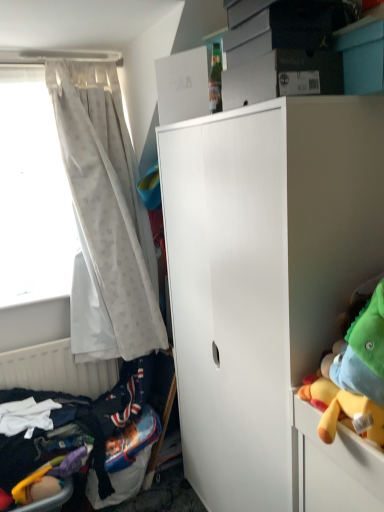
Question: Does white matte radiator at lower left lie in front of dark blue fabric bed at lower left?

Choices:
 (A) yes
 (B) no

Answer: (B)

Question: Is white matte radiator at lower left directly adjacent to dark blue fabric bed at lower left?

Choices:
 (A) no
 (B) yes

Answer: (A)

Question: Can you confirm if white matte radiator at lower left is smaller than dark blue fabric bed at lower left?

Choices:
 (A) yes
 (B) no

Answer: (A)

Question: Considering the relative sizes of white matte radiator at lower left and dark blue fabric bed at lower left in the image provided, is white matte radiator at lower left wider than dark blue fabric bed at lower left?

Choices:
 (A) no
 (B) yes

Answer: (A)

Question: Is white matte radiator at lower left at the left side of dark blue fabric bed at lower left?

Choices:
 (A) no
 (B) yes

Answer: (B)

Question: Considering the positions of point (1, 232) and point (236, 329), is point (1, 232) closer or farther from the camera than point (236, 329)?

Choices:
 (A) farther
 (B) closer

Answer: (A)

Question: Considering the positions of white sheer curtain at left and white matte cabinet at center in the image, is white sheer curtain at left wider or thinner than white matte cabinet at center?

Choices:
 (A) thin
 (B) wide

Answer: (A)

Question: Is white sheer curtain at left bigger or smaller than white matte cabinet at center?

Choices:
 (A) small
 (B) big

Answer: (A)

Question: From their relative heights in the image, would you say white sheer curtain at left is taller or shorter than white matte cabinet at center?

Choices:
 (A) tall
 (B) short

Answer: (B)

Question: Considering the positions of point (132, 297) and point (233, 376), is point (132, 297) closer or farther from the camera than point (233, 376)?

Choices:
 (A) closer
 (B) farther

Answer: (B)

Question: Considering the positions of white sheer curtain at left and white matte cabinet at center in the image, is white sheer curtain at left bigger or smaller than white matte cabinet at center?

Choices:
 (A) big
 (B) small

Answer: (B)

Question: Is white sheer curtain at left inside the boundaries of white matte cabinet at center, or outside?

Choices:
 (A) inside
 (B) outside

Answer: (B)

Question: From the image's perspective, is white sheer curtain at left above or below white matte cabinet at center?

Choices:
 (A) below
 (B) above

Answer: (B)

Question: In terms of size, does white matte radiator at lower left appear bigger or smaller than white matte cabinet at center?

Choices:
 (A) big
 (B) small

Answer: (B)

Question: Considering the positions of point (23, 367) and point (294, 369), is point (23, 367) closer or farther from the camera than point (294, 369)?

Choices:
 (A) farther
 (B) closer

Answer: (A)